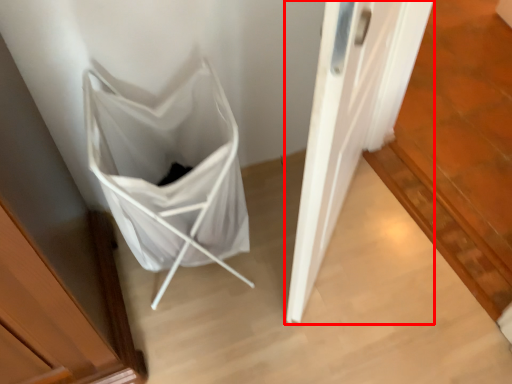
Question: Where is door (annotated by the red box) located in relation to folding chair in the image?

Choices:
 (A) right
 (B) left

Answer: (A)